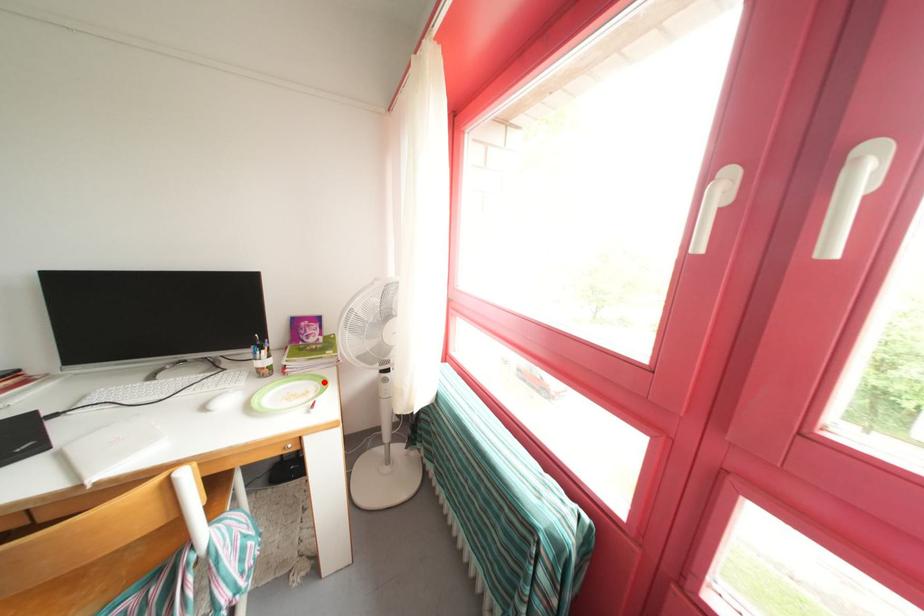
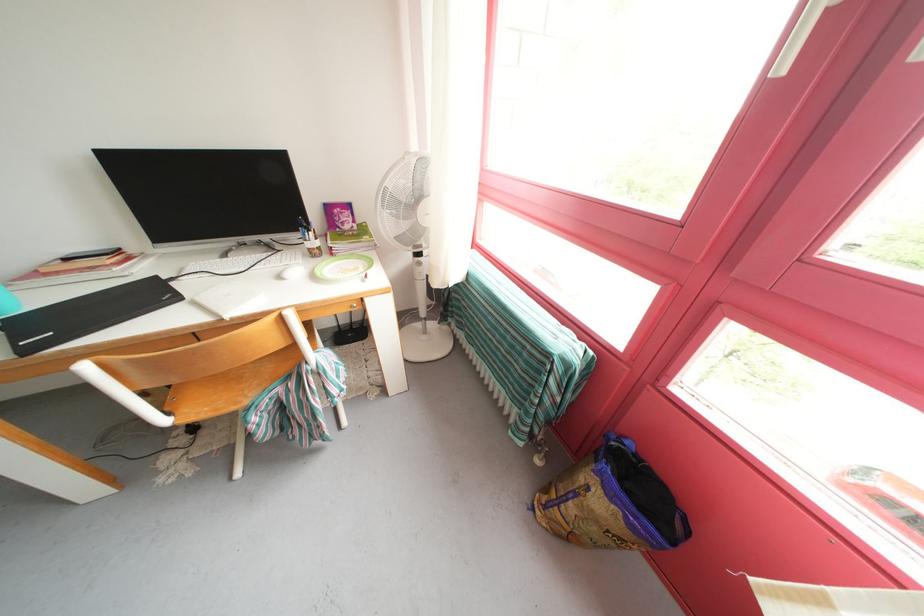
Question: I am providing you with two images of the same scene from different viewpoints. Image1 has a red point marked. In image2, the corresponding 3D location appears at what relative position? Reply with the corresponding letter.

Choices:
 (A) Closer
 (B) Farther

Answer: (B)